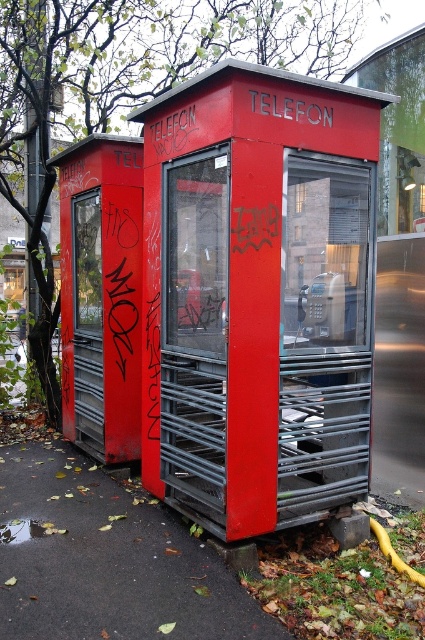
You are a delivery person trying to fit a small package between the matte red telephone booth at center and the metallic gray telephone at center. Based on the scene, can the package fit if it requires at least 1 meter of space between them?

The matte red telephone booth at center is wider than the metallic gray telephone at center. Since the package requires at least 1 meter of space between them, but the exact distance isn

Looking at this image, you are a delivery person trying to place a small package between the matte red telephone booth at center and the metallic gray telephone at center. Can you fit the package vertically between them?

The matte red telephone booth at center is taller than the metallic gray telephone at center, so the vertical space between them may be sufficient to fit the package. However, the exact height difference is unknown, so it depends on the package size.